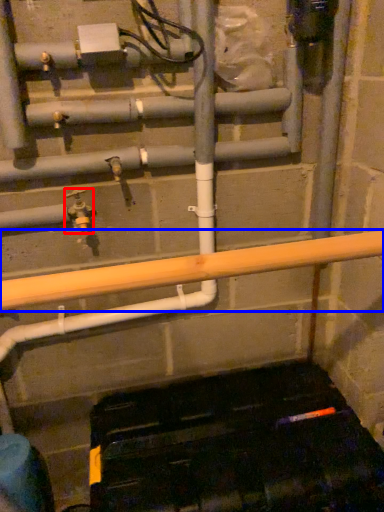
Question: Among these objects, which one is nearest to the camera, plumbing fixture (highlighted by a red box) or beam (highlighted by a blue box)?

Choices:
 (A) plumbing fixture
 (B) beam

Answer: (B)